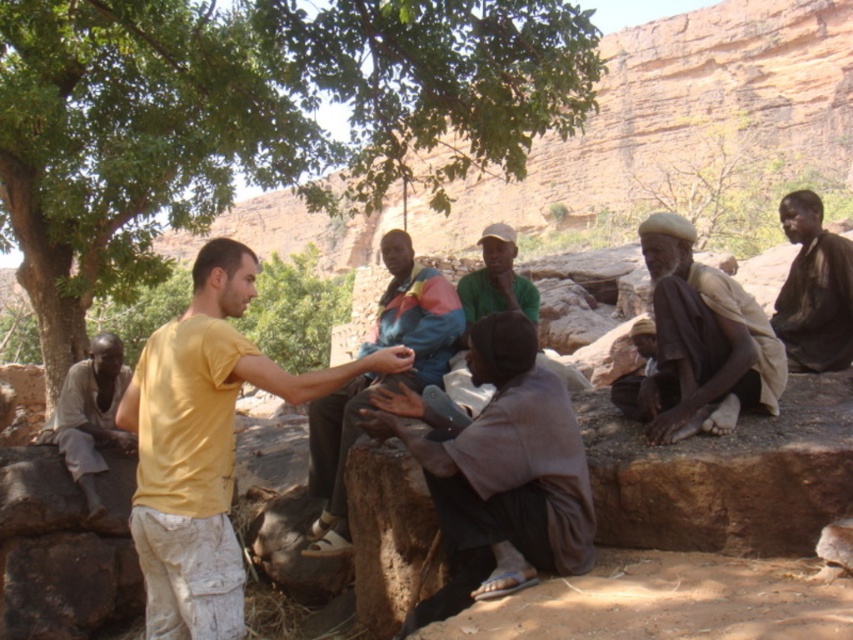
Question: Which of these objects is positioned farthest from the green leafy tree at upper left?

Choices:
 (A) multicolored fabric at center
 (B) brown fabric cloth at center

Answer: (B)

Question: Can you confirm if multicolored fabric at center is wider than dark brown fabric at right?

Choices:
 (A) yes
 (B) no

Answer: (A)

Question: Which point is farther from the camera taking this photo?

Choices:
 (A) (126, 436)
 (B) (813, 305)

Answer: (A)

Question: Where is brown woven cloth at lower right located in relation to multicolored fabric at center in the image?

Choices:
 (A) below
 (B) above

Answer: (B)

Question: Does green leafy tree at upper left come behind multicolored fabric at center?

Choices:
 (A) yes
 (B) no

Answer: (A)

Question: Based on their relative distances, which object is farther from the green leafy tree at upper left?

Choices:
 (A) dark brown fabric at right
 (B) green fabric cap at center
 (C) brown woven cloth at lower right

Answer: (A)